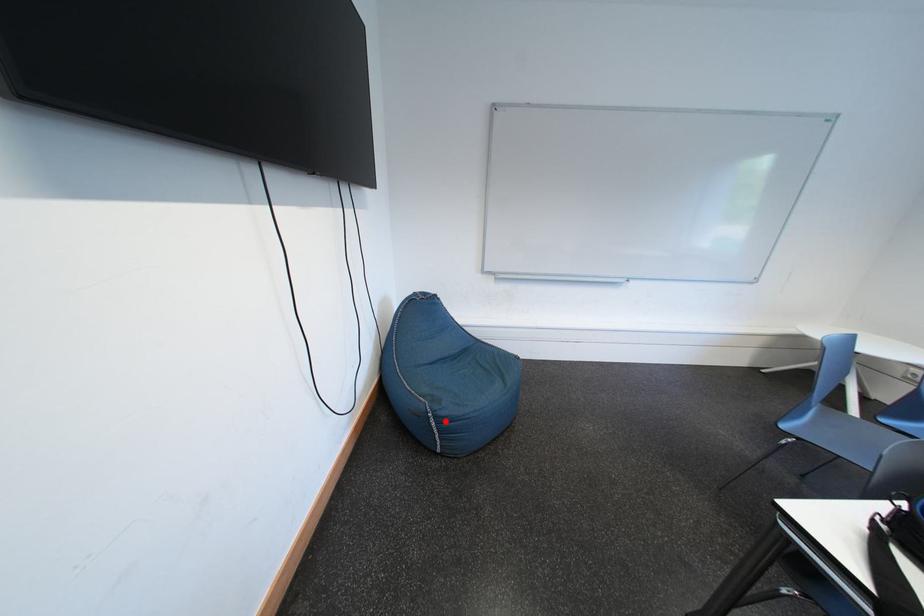
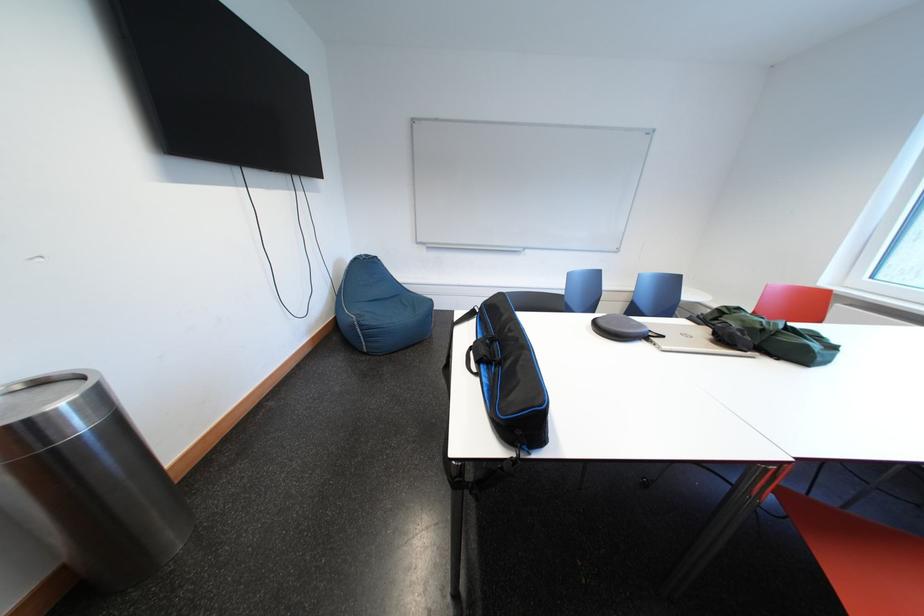
In the second image, find the point that corresponds to the highlighted location in the first image.

(370, 330)